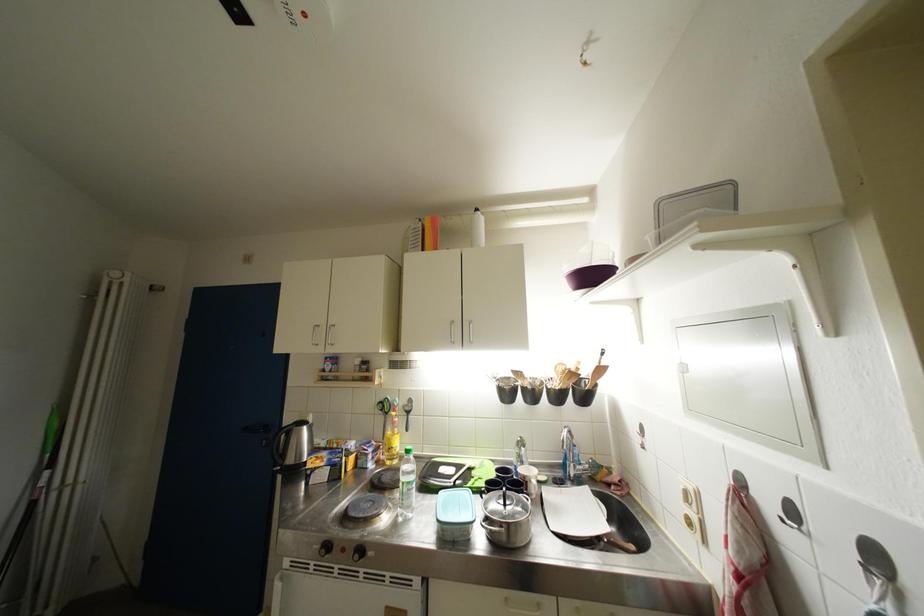
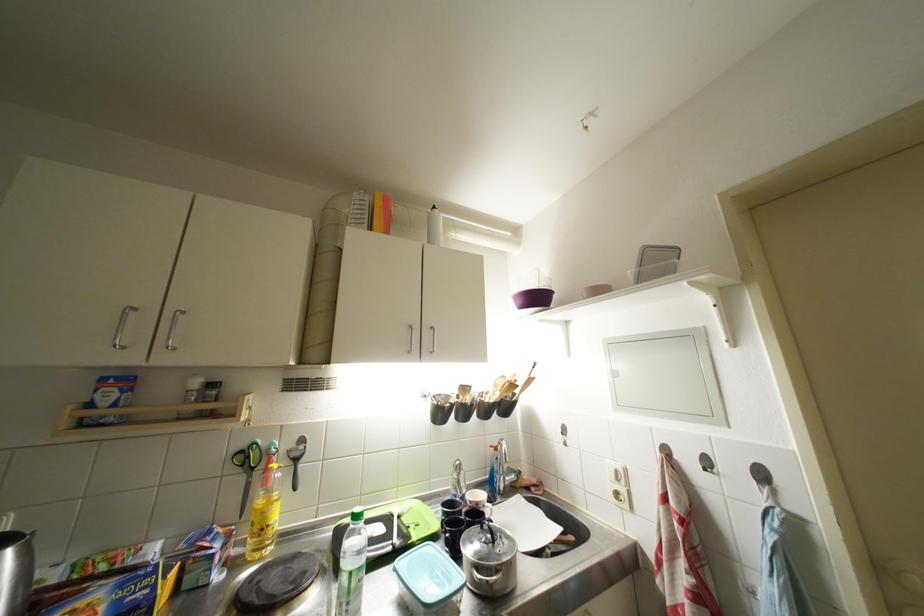
In the second image, find the point that corresponds to (x=388, y=403) in the first image.

(249, 450)